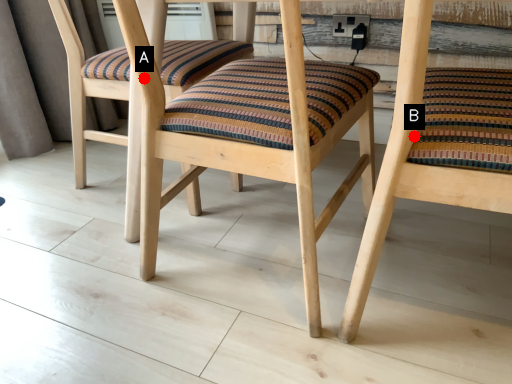
Question: Two points are circled on the image, labeled by A and B beside each circle. Among these points, which one is nearest to the camera?

Choices:
 (A) A is closer
 (B) B is closer

Answer: (B)